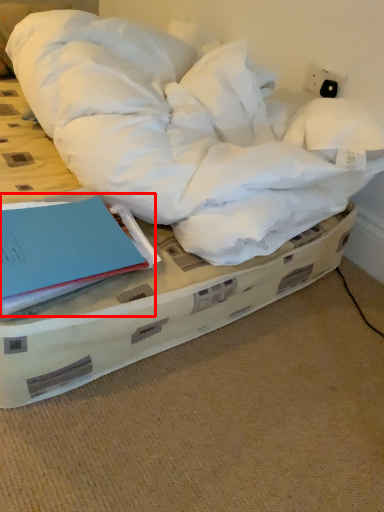
Question: From the image's perspective, considering the relative positions of paperback book (annotated by the red box) and bed in the image provided, where is paperback book (annotated by the red box) located with respect to the staircase?

Choices:
 (A) above
 (B) below

Answer: (B)